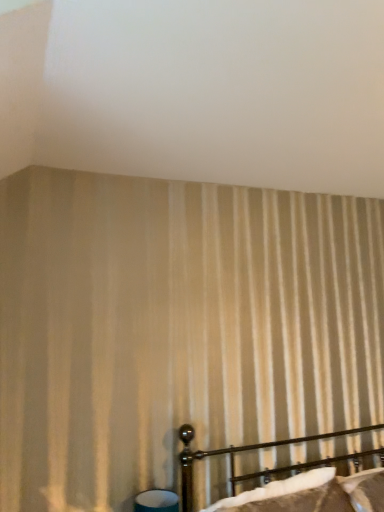
Locate an element on the screen. This screenshot has width=384, height=512. teal fabric table lamp at lower center is located at coordinates (156, 501).

What do you see at coordinates (156, 501) in the screenshot? I see `teal fabric table lamp at lower center` at bounding box center [156, 501].

Describe the element at coordinates (262, 448) in the screenshot. I see `polished dark brown bed at lower right` at that location.

What is the approximate height of polished dark brown bed at lower right?

The height of polished dark brown bed at lower right is 14.35 inches.

This screenshot has width=384, height=512. I want to click on polished dark brown bed at lower right, so click(262, 448).

Locate an element on the screen. The height and width of the screenshot is (512, 384). teal fabric table lamp at lower center is located at coordinates (156, 501).

Considering the relative positions of polished dark brown bed at lower right and teal fabric table lamp at lower center in the image provided, is polished dark brown bed at lower right to the left or to the right of teal fabric table lamp at lower center?

polished dark brown bed at lower right is positioned on teal fabric table lamp at lower center's right side.

Does polished dark brown bed at lower right come in front of teal fabric table lamp at lower center?

Yes.

Between point (231, 466) and point (154, 496), which one is positioned behind?

The point (231, 466) is farther from the camera.

Based on the photo, from the image's perspective, which is below, polished dark brown bed at lower right or teal fabric table lamp at lower center?

teal fabric table lamp at lower center is shown below in the image.

From a real-world perspective, is polished dark brown bed at lower right below teal fabric table lamp at lower center?

No, from a real-world perspective, polished dark brown bed at lower right is not beneath teal fabric table lamp at lower center.

Looking at their sizes, would you say polished dark brown bed at lower right is wider or thinner than teal fabric table lamp at lower center?

polished dark brown bed at lower right is wider than teal fabric table lamp at lower center.

Considering the relative sizes of polished dark brown bed at lower right and teal fabric table lamp at lower center in the image provided, is polished dark brown bed at lower right taller than teal fabric table lamp at lower center?

Correct, polished dark brown bed at lower right is much taller as teal fabric table lamp at lower center.

Considering the relative sizes of polished dark brown bed at lower right and teal fabric table lamp at lower center in the image provided, is polished dark brown bed at lower right smaller than teal fabric table lamp at lower center?

Incorrect, polished dark brown bed at lower right is not smaller in size than teal fabric table lamp at lower center.

Would you say polished dark brown bed at lower right is outside teal fabric table lamp at lower center?

polished dark brown bed at lower right lies outside teal fabric table lamp at lower center's area.

Is polished dark brown bed at lower right touching teal fabric table lamp at lower center?

polished dark brown bed at lower right is not next to teal fabric table lamp at lower center, and they're not touching.

Does polished dark brown bed at lower right turn towards teal fabric table lamp at lower center?

No, polished dark brown bed at lower right is not facing towards teal fabric table lamp at lower center.

How many degrees apart are the facing directions of polished dark brown bed at lower right and teal fabric table lamp at lower center?

There is a 0.000238-degree angle between the facing directions of polished dark brown bed at lower right and teal fabric table lamp at lower center.

How distant is polished dark brown bed at lower right from teal fabric table lamp at lower center?

polished dark brown bed at lower right is 14.08 inches from teal fabric table lamp at lower center.

Where is `bed above the teal fabric table lamp at lower center (from the image's perspective)`? bed above the teal fabric table lamp at lower center (from the image's perspective) is located at coordinates (262, 448).

Is teal fabric table lamp at lower center at the left side of polished dark brown bed at lower right?

Correct, you'll find teal fabric table lamp at lower center to the left of polished dark brown bed at lower right.

Relative to polished dark brown bed at lower right, is teal fabric table lamp at lower center in front or behind?

teal fabric table lamp at lower center is positioned farther from the viewer than polished dark brown bed at lower right.

Which is nearer, (141, 492) or (382, 461)?

Clearly, point (141, 492) is closer to the camera than point (382, 461).

From the image's perspective, which is below, teal fabric table lamp at lower center or polished dark brown bed at lower right?

teal fabric table lamp at lower center.

From a real-world perspective, is teal fabric table lamp at lower center positioned over polished dark brown bed at lower right based on gravity?

Incorrect, from a real-world perspective, teal fabric table lamp at lower center is lower than polished dark brown bed at lower right.

Is teal fabric table lamp at lower center thinner than polished dark brown bed at lower right?

Yes.

Considering the relative sizes of teal fabric table lamp at lower center and polished dark brown bed at lower right in the image provided, is teal fabric table lamp at lower center taller than polished dark brown bed at lower right?

In fact, teal fabric table lamp at lower center may be shorter than polished dark brown bed at lower right.

Is teal fabric table lamp at lower center smaller than polished dark brown bed at lower right?

Indeed, teal fabric table lamp at lower center has a smaller size compared to polished dark brown bed at lower right.

Does teal fabric table lamp at lower center contain polished dark brown bed at lower right?

No.

Is teal fabric table lamp at lower center touching polished dark brown bed at lower right?

No, teal fabric table lamp at lower center is not making contact with polished dark brown bed at lower right.

Does teal fabric table lamp at lower center turn towards polished dark brown bed at lower right?

No, teal fabric table lamp at lower center does not turn towards polished dark brown bed at lower right.

How many degrees apart are the facing directions of teal fabric table lamp at lower center and polished dark brown bed at lower right?

0.000238 degrees separate the facing orientations of teal fabric table lamp at lower center and polished dark brown bed at lower right.

How far apart are teal fabric table lamp at lower center and polished dark brown bed at lower right?

teal fabric table lamp at lower center and polished dark brown bed at lower right are 14.08 inches apart from each other.

At what (x,y) coordinates should I click in order to perform the action: click on bed above the teal fabric table lamp at lower center (from the image's perspective). Please return your answer as a coordinate pair (x, y). Looking at the image, I should click on (262, 448).

Locate an element on the screen. The width and height of the screenshot is (384, 512). table lamp on the left of polished dark brown bed at lower right is located at coordinates (156, 501).

Image resolution: width=384 pixels, height=512 pixels. What are the coordinates of `table lamp behind the polished dark brown bed at lower right` in the screenshot? It's located at (156, 501).